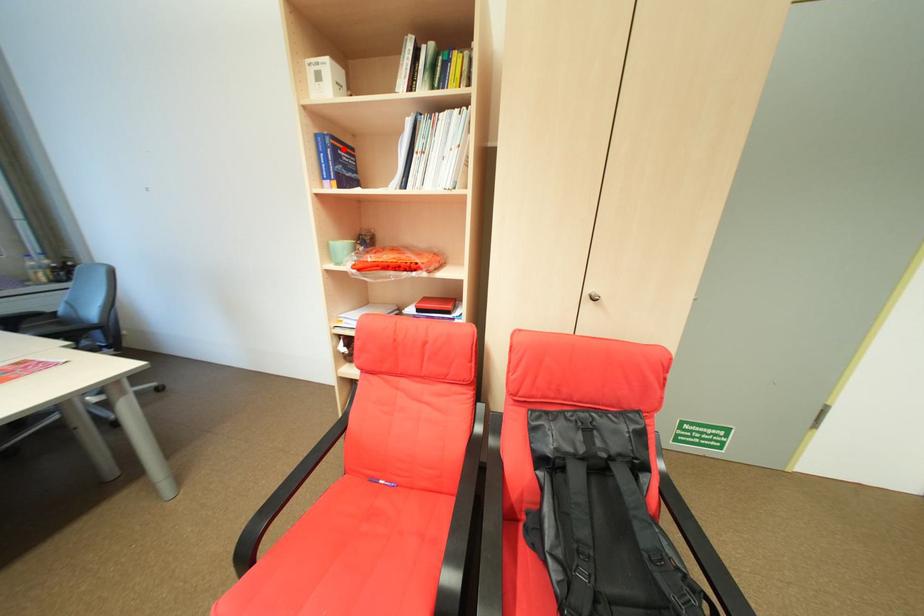
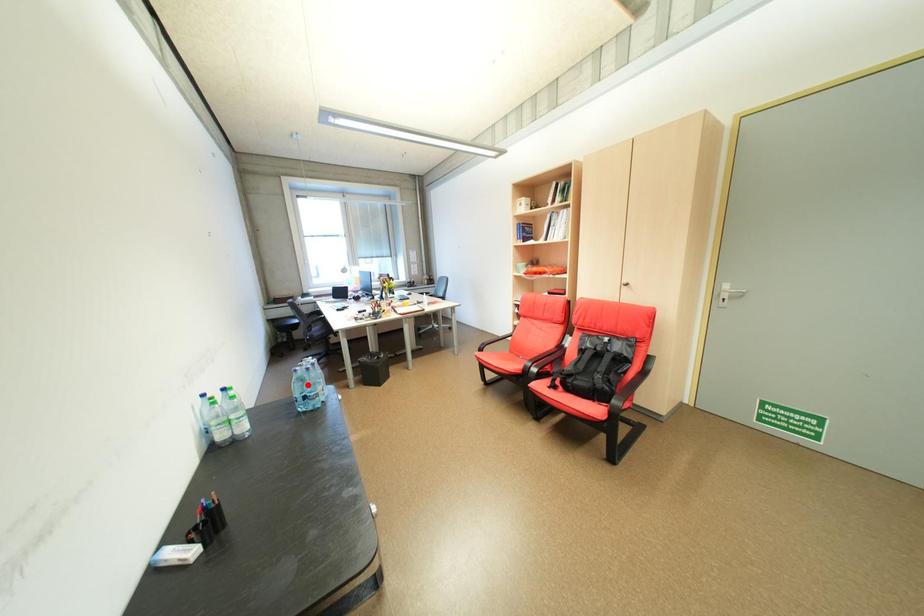
I am providing you with two images of the same scene from different viewpoints. A red point is marked on the first image and another point is marked on the second image. Do the highlighted points in image1 and image2 indicate the same real-world spot?

No